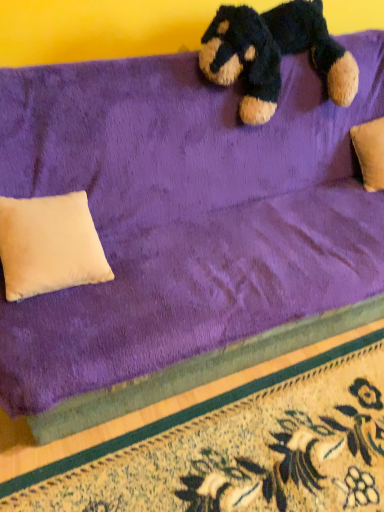
The width and height of the screenshot is (384, 512). What do you see at coordinates (49, 245) in the screenshot? I see `beige suede pillow at lower left` at bounding box center [49, 245].

Where is `beige suede pillow at lower left`? The image size is (384, 512). beige suede pillow at lower left is located at coordinates (49, 245).

Measure the distance between floral carpet at lower right and camera.

Answer: The distance of floral carpet at lower right from camera is 1.17 meters.

You are a GUI agent. You are given a task and a screenshot of the screen. Output one action in this format:
    pyautogui.click(x=<x>, y=<y>)
    Task: Click on the velvety dark blue teddy bear at upper center
    Image resolution: width=384 pixels, height=512 pixels.
    Given the screenshot: What is the action you would take?
    pyautogui.click(x=274, y=54)

Where is `beige suede pillow at lower left`? This screenshot has height=512, width=384. beige suede pillow at lower left is located at coordinates (49, 245).

From a real-world perspective, which is physically below, floral carpet at lower right or beige suede pillow at lower left?

floral carpet at lower right is physically lower.

Considering the relative sizes of floral carpet at lower right and beige suede pillow at lower left in the image provided, is floral carpet at lower right smaller than beige suede pillow at lower left?

Actually, floral carpet at lower right might be larger than beige suede pillow at lower left.

Which point is more forward, (355, 458) or (79, 274)?

The point (355, 458) is closer.

Considering the relative sizes of floral carpet at lower right and beige suede pillow at lower left in the image provided, is floral carpet at lower right taller than beige suede pillow at lower left?

No, floral carpet at lower right is not taller than beige suede pillow at lower left.

You are a GUI agent. You are given a task and a screenshot of the screen. Output one action in this format:
    pyautogui.click(x=<x>, y=<y>)
    Task: Click on the doormat that appears below the velvety dark blue teddy bear at upper center (from a real-world perspective)
    The image size is (384, 512).
    Given the screenshot: What is the action you would take?
    pyautogui.click(x=239, y=449)

Between velvety dark blue teddy bear at upper center and floral carpet at lower right, which one has more height?

velvety dark blue teddy bear at upper center.

From the image's perspective, between velvety dark blue teddy bear at upper center and floral carpet at lower right, who is located below?

From the image's view, floral carpet at lower right is below.

Which object is more forward, velvety dark blue teddy bear at upper center or floral carpet at lower right?

floral carpet at lower right is in front.

Which point is more distant from viewer, [15,212] or [206,46]?

The point [206,46] is more distant.

Do you think beige suede pillow at lower left is within velvety dark blue teddy bear at upper center, or outside of it?

beige suede pillow at lower left is located beyond the bounds of velvety dark blue teddy bear at upper center.

Which of these two, beige suede pillow at lower left or velvety dark blue teddy bear at upper center, is bigger?

velvety dark blue teddy bear at upper center.

Would you say velvety dark blue teddy bear at upper center is outside beige suede pillow at lower left?

Yes, velvety dark blue teddy bear at upper center is outside of beige suede pillow at lower left.

From the image's perspective, is velvety dark blue teddy bear at upper center over beige suede pillow at lower left?

Correct, velvety dark blue teddy bear at upper center appears higher than beige suede pillow at lower left in the image.

I want to click on pillow lying in front of the velvety dark blue teddy bear at upper center, so click(49, 245).

Considering the relative positions of velvety dark blue teddy bear at upper center and beige suede pillow at lower left in the image provided, is velvety dark blue teddy bear at upper center behind beige suede pillow at lower left?

Yes, it is.

Consider the image. Is beige suede pillow at lower left bigger than floral carpet at lower right?

Actually, beige suede pillow at lower left might be smaller than floral carpet at lower right.

Where is `pillow above the floral carpet at lower right (from the image's perspective)`? This screenshot has height=512, width=384. pillow above the floral carpet at lower right (from the image's perspective) is located at coordinates (x=49, y=245).

Relative to floral carpet at lower right, is beige suede pillow at lower left in front or behind?

beige suede pillow at lower left is positioned farther from the viewer than floral carpet at lower right.

From the image's perspective, is beige suede pillow at lower left on floral carpet at lower right?

Yes, from the image's perspective, beige suede pillow at lower left is over floral carpet at lower right.

Which of these two, floral carpet at lower right or velvety dark blue teddy bear at upper center, is smaller?

With smaller size is floral carpet at lower right.

Which of these two, floral carpet at lower right or velvety dark blue teddy bear at upper center, stands taller?

Standing taller between the two is velvety dark blue teddy bear at upper center.

Is point (148, 454) closer to camera compared to point (330, 70)?

Yes, it is in front of point (330, 70).

Is velvety dark blue teddy bear at upper center a part of floral carpet at lower right?

No, velvety dark blue teddy bear at upper center is located outside of floral carpet at lower right.

Where is `pillow above the floral carpet at lower right (from a real-world perspective)`? The image size is (384, 512). pillow above the floral carpet at lower right (from a real-world perspective) is located at coordinates (49, 245).

I want to click on doormat that is in front of the velvety dark blue teddy bear at upper center, so click(x=239, y=449).

Which object lies further to the anchor point floral carpet at lower right, beige suede pillow at lower left or velvety dark blue teddy bear at upper center?

Among the two, velvety dark blue teddy bear at upper center is located further to floral carpet at lower right.

Which object lies further to the anchor point floral carpet at lower right, velvety dark blue teddy bear at upper center or beige suede pillow at lower left?

velvety dark blue teddy bear at upper center is further to floral carpet at lower right.

Which object lies nearer to the anchor point velvety dark blue teddy bear at upper center, beige suede pillow at lower left or floral carpet at lower right?

Among the two, beige suede pillow at lower left is located nearer to velvety dark blue teddy bear at upper center.

Estimate the real-world distances between objects in this image. Which object is further from beige suede pillow at lower left, floral carpet at lower right or velvety dark blue teddy bear at upper center?

velvety dark blue teddy bear at upper center.

Which object lies further to the anchor point beige suede pillow at lower left, velvety dark blue teddy bear at upper center or floral carpet at lower right?

velvety dark blue teddy bear at upper center is positioned further to the anchor beige suede pillow at lower left.

Which object lies further to the anchor point velvety dark blue teddy bear at upper center, floral carpet at lower right or beige suede pillow at lower left?

Based on the image, floral carpet at lower right appears to be further to velvety dark blue teddy bear at upper center.

Find the location of a particular element. The image size is (384, 512). pillow that lies between velvety dark blue teddy bear at upper center and floral carpet at lower right from top to bottom is located at coordinates [x=49, y=245].